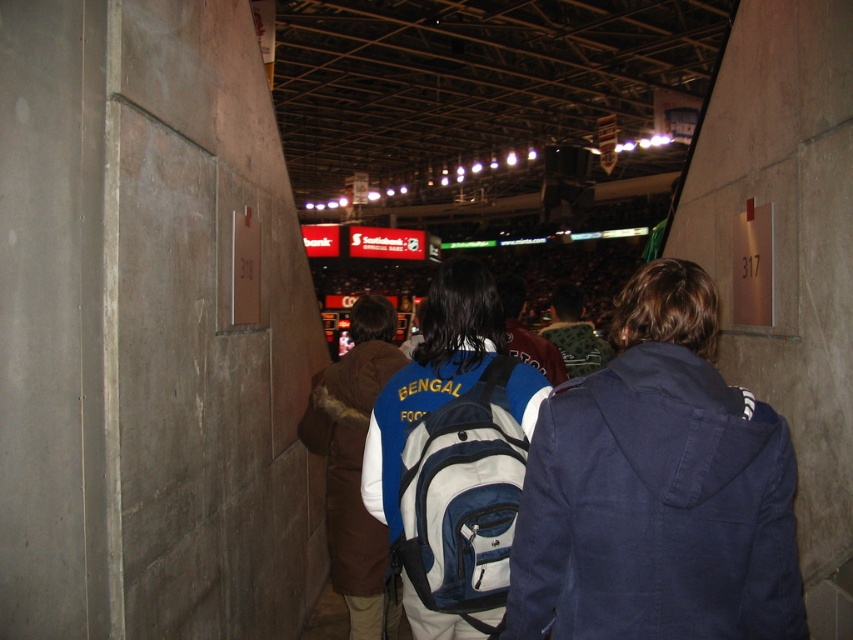
Which is behind, point (173, 65) or point (610, 355)?

Point (610, 355)

Image resolution: width=853 pixels, height=640 pixels. I want to click on concrete wall at center, so click(x=148, y=332).

Which is above, concrete wall at center or blue fabric backpack at center?

concrete wall at center

Can you confirm if concrete wall at center is positioned below blue fabric backpack at center?

No.

Does point (15, 545) come farther from viewer compared to point (421, 384)?

No.

Where is `concrete wall at center`? concrete wall at center is located at coordinates (148, 332).

Can you confirm if navy blue jacket at center is positioned below brown fuzzy vest at center?

Incorrect, navy blue jacket at center is not positioned below brown fuzzy vest at center.

Which of these two, navy blue jacket at center or brown fuzzy vest at center, stands shorter?

Standing shorter between the two is navy blue jacket at center.

Describe the element at coordinates (657, 490) in the screenshot. The image size is (853, 640). I see `navy blue jacket at center` at that location.

This screenshot has width=853, height=640. I want to click on navy blue jacket at center, so click(657, 490).